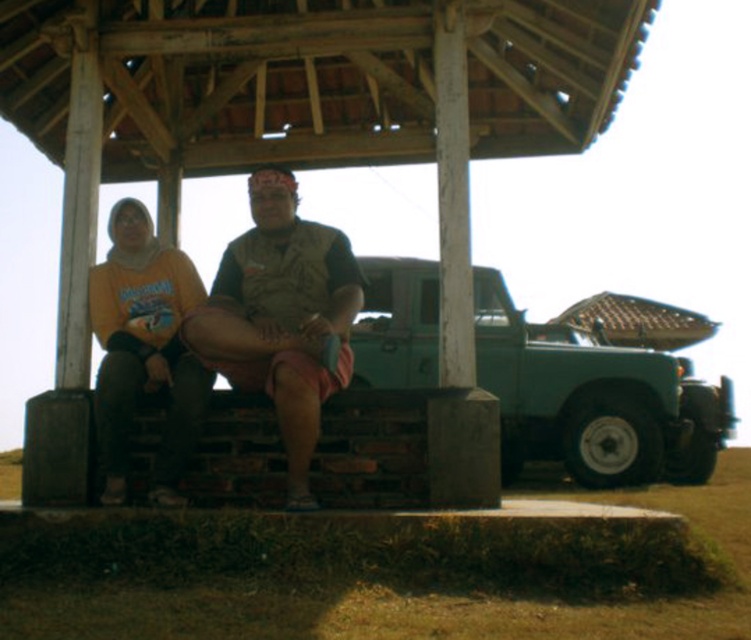
You are organizing a clothing sale and need to display the camouflage fabric shirt at center and the matte yellow hoodie at left on adjacent hangers. If the hanger spacing allows only 10 cm between items, can both items fit side by side without overlapping?

The camouflage fabric shirt at center is wider than the matte yellow hoodie at left. However, the exact widths are not provided, so we cannot determine if the combined width of both items exceeds 10 cm. Additional measurements are needed to confirm.

You are standing at the location of point (140, 333) and want to move towards point (267, 348). Based on the scene description, will you be moving forward or backward relative to your current position?

Since point (267, 348) is in front of point (140, 333), moving towards it would mean moving forward relative to your current position at point (140, 333).

You are a photographer standing at the edge of the gazebo. You want to take a photo of both the camouflage fabric shirt at center and the matte yellow hoodie at left. If your camera has a maximum focus range of 1.5 meters, will both subjects be in focus?

The camouflage fabric shirt at center is 1.48 meters away from matte yellow hoodie at left. Since the distance between them is within the camera maximum focus range of 1.5 meters, both subjects will be in focus.